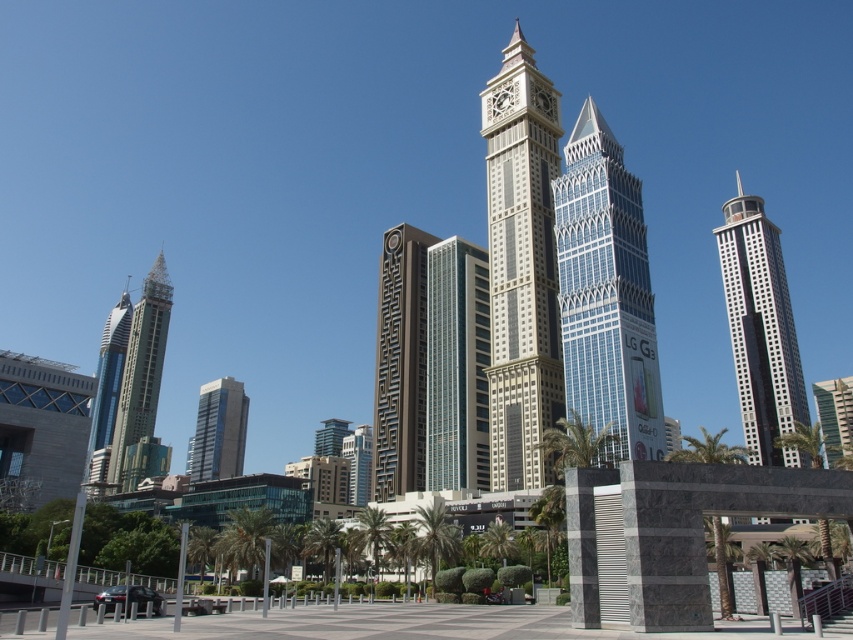
Question: Estimate the real-world distances between objects in this image. Which object is closer to the matte white clock at upper center?

Choices:
 (A) brown textured tower at center
 (B) blue glass skyscraper at left
 (C) green glass building at center
 (D) blue glass skyscraper at center

Answer: (C)

Question: Which point appears farthest from the camera in this image?

Choices:
 (A) (434, 353)
 (B) (402, 298)

Answer: (B)

Question: Considering the relative positions of green glass building at center and shiny blue glass skyscraper at left in the image provided, where is green glass building at center located with respect to shiny blue glass skyscraper at left?

Choices:
 (A) left
 (B) right

Answer: (B)

Question: Which point is farther to the camera?

Choices:
 (A) (741, 308)
 (B) (451, 304)

Answer: (A)

Question: Is white glass tower at right closer to camera compared to green glass building at center?

Choices:
 (A) no
 (B) yes

Answer: (B)

Question: Is white glass tower at right to the right of shiny blue glass skyscraper at left from the viewer's perspective?

Choices:
 (A) no
 (B) yes

Answer: (B)